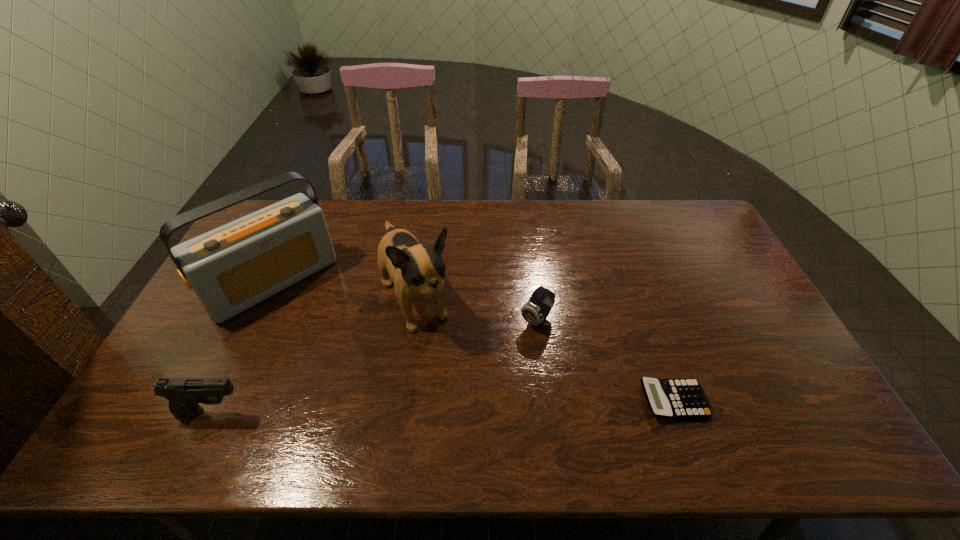
Where is `pistol`? The height and width of the screenshot is (540, 960). pistol is located at coordinates (184, 394).

Locate an element on the screen. The image size is (960, 540). the rightmost object is located at coordinates (675, 398).

Where is `calculator`? Image resolution: width=960 pixels, height=540 pixels. calculator is located at coordinates (675, 398).

Locate an element on the screen. watch is located at coordinates (536, 310).

At what (x,y) coordinates should I click in order to perform the action: click on the third object from left to right. Please return your answer as a coordinate pair (x, y). The width and height of the screenshot is (960, 540). Looking at the image, I should click on (417, 270).

The height and width of the screenshot is (540, 960). In order to click on radio receiver in this screenshot , I will do `click(232, 268)`.

Where is `free space located 0.210m at the barrel of the pistol`? This screenshot has width=960, height=540. free space located 0.210m at the barrel of the pistol is located at coordinates (333, 411).

Find the location of `free space located 0.090m on the back of the calculator`. free space located 0.090m on the back of the calculator is located at coordinates (657, 353).

Where is `vacant area situated on the face of the watch`? The width and height of the screenshot is (960, 540). vacant area situated on the face of the watch is located at coordinates (512, 347).

Locate an element on the screen. vacant space situated 0.290m on the face of the watch is located at coordinates (459, 402).